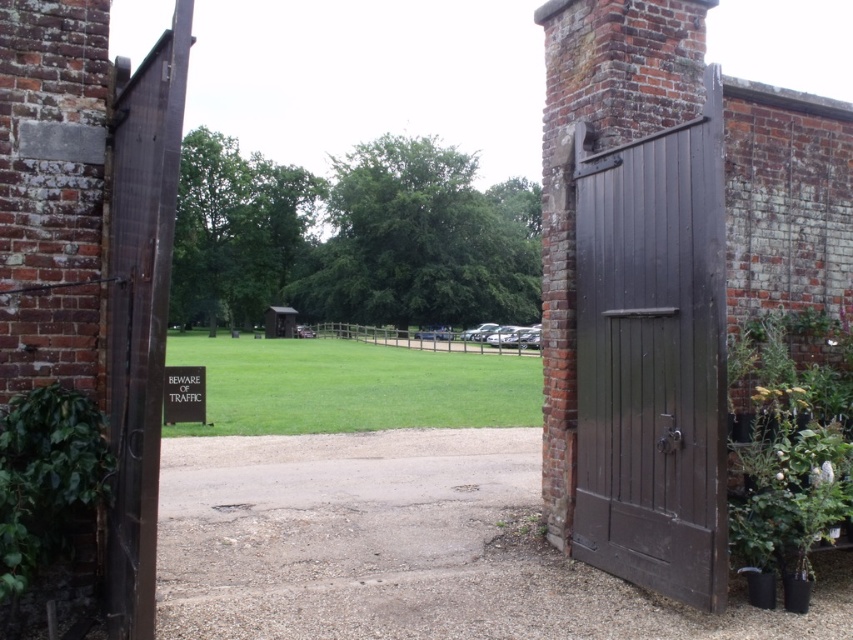
You are standing in front of the open wooden gate and see the point at coordinates (653, 360). What object does this coordinate correspond to?

The point at coordinates (653, 360) corresponds to the matte dark wood door at right.

You are standing outside the gate and want to enter the area. You see the matte dark wood door at right and the green leafy plant at left. Which object is closer to you as you face the gate?

The matte dark wood door at right is closer to you because the green leafy plant at left is behind it.